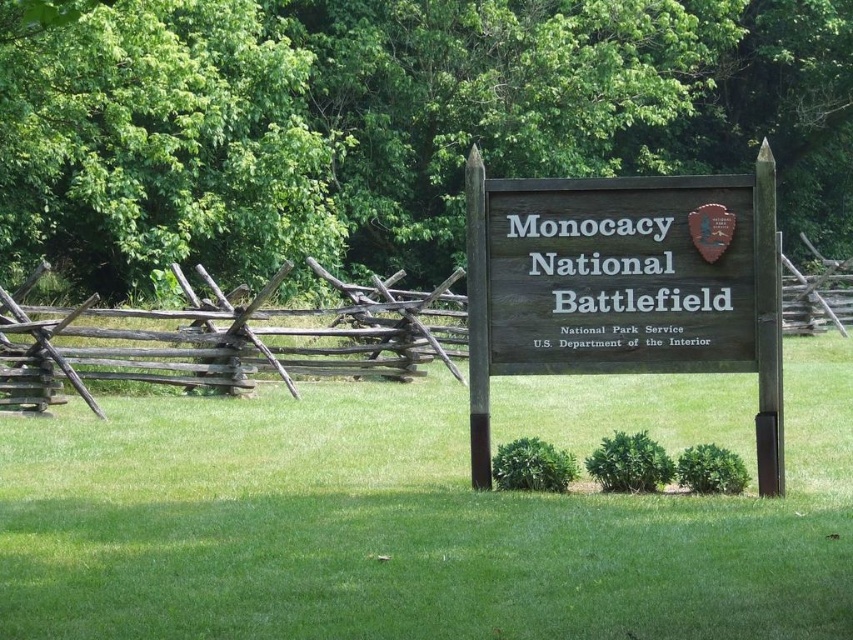
You are standing at the wooden sign in the foreground of the Monocacy National Battlefield scene. Looking towards the background, where is the green leafy tree at upper center positioned relative to the rustic wooden fence?

The green leafy tree at upper center is located at point 0.192 on the horizontal axis and 0.455 on the vertical axis, which places it above the rustic wooden fence that runs horizontally across the image.

You are standing at the Monocacy National Battlefield and want to take a photo of the wooden sign and the rustic wooden fence in the background. If you are currently at the point with coordinates point (x=606, y=52), which is 34.81 meters away from the camera, can you capture both the sign and the fence in a single frame without moving your position?

The point (x=606, y=52) is 34.81 meters away from the camera. Since the wooden sign is in the foreground and the rustic wooden fence is in the background, both are within the same distance range from the camera, so yes, you can capture both the wooden sign and the rustic wooden fence in a single frame without moving your position.